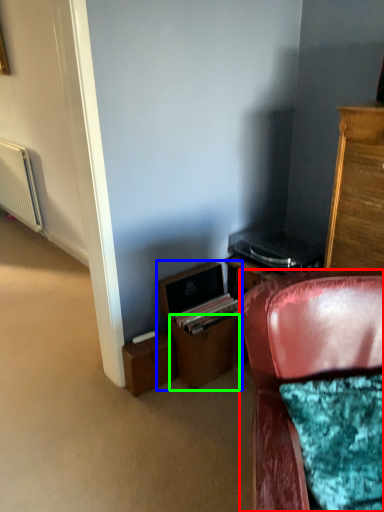
Question: Considering the real-world distances, which object is closest to chair (highlighted by a red box)? file cabinet (highlighted by a blue box) or drawer (highlighted by a green box).

Choices:
 (A) file cabinet
 (B) drawer

Answer: (B)